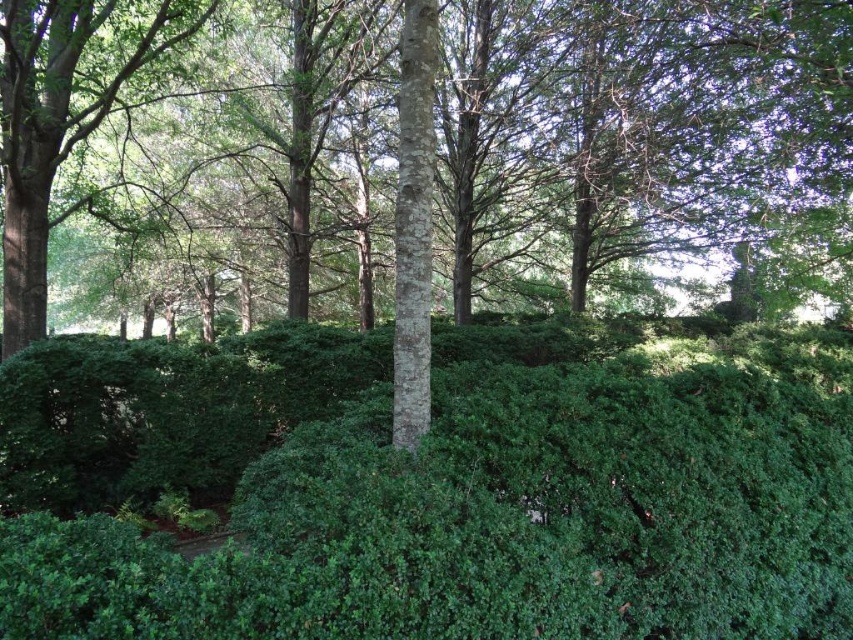
Which is above, smooth bark tree at center or green leafy tree at left?

Positioned higher is smooth bark tree at center.

Between smooth bark tree at center and green leafy tree at left, which one is positioned lower?

green leafy tree at left is lower down.

Where is `smooth bark tree at center`? smooth bark tree at center is located at coordinates (641, 144).

Where is `smooth bark tree at center`? The image size is (853, 640). smooth bark tree at center is located at coordinates (641, 144).

The width and height of the screenshot is (853, 640). I want to click on green leafy hedge at center, so click(434, 486).

Who is shorter, green leafy hedge at center or green leafy tree at left?

green leafy hedge at center

Which is behind, point (344, 499) or point (35, 173)?

Positioned behind is point (35, 173).

Locate an element on the screen. The image size is (853, 640). green leafy hedge at center is located at coordinates (434, 486).

Which is in front, point (100, 577) or point (67, 152)?

Positioned in front is point (100, 577).

Who is more forward, (264, 573) or (809, 10)?

Positioned in front is point (264, 573).

Where is `green leafy hedge at center`? Image resolution: width=853 pixels, height=640 pixels. green leafy hedge at center is located at coordinates (434, 486).